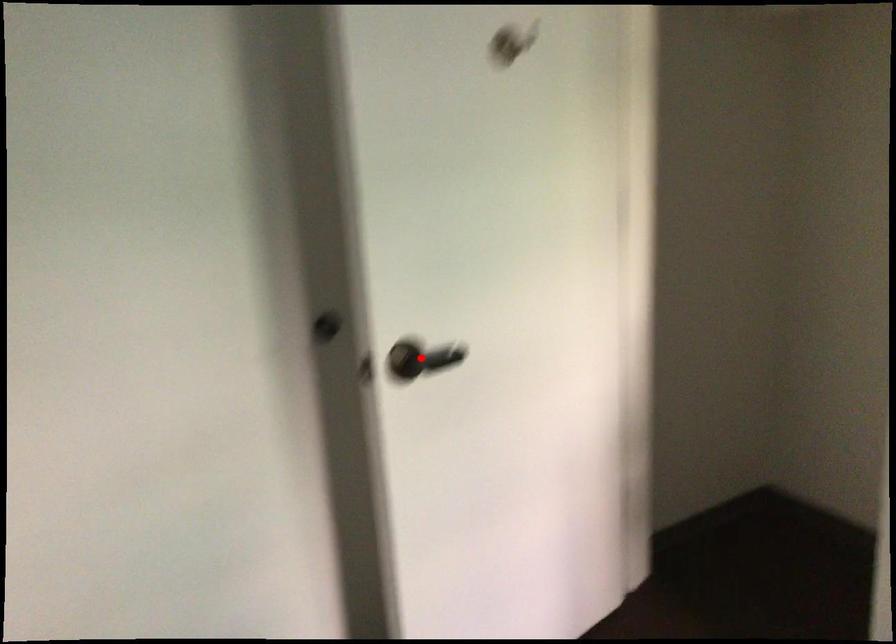
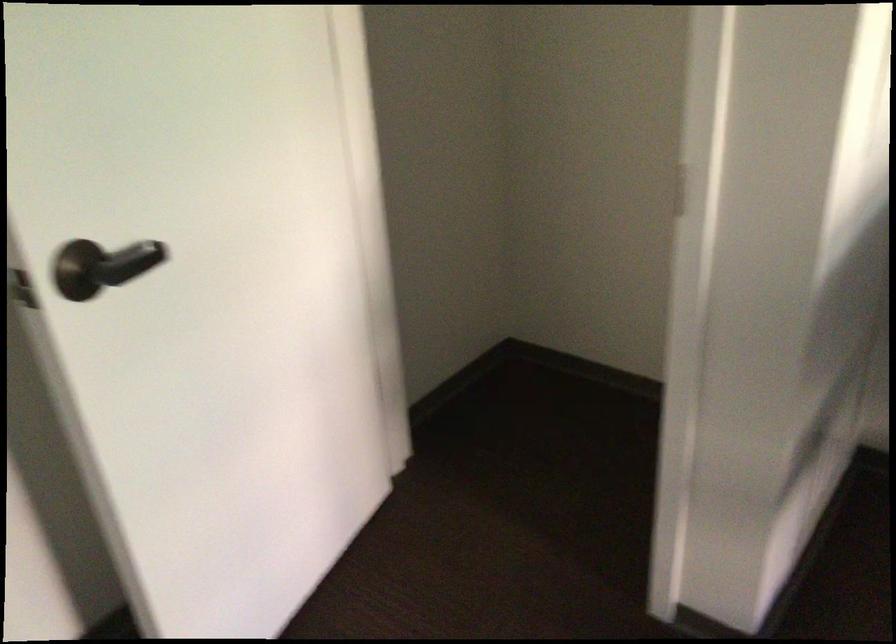
In the second image, find the point that corresponds to the highlighted location in the first image.

(107, 265)